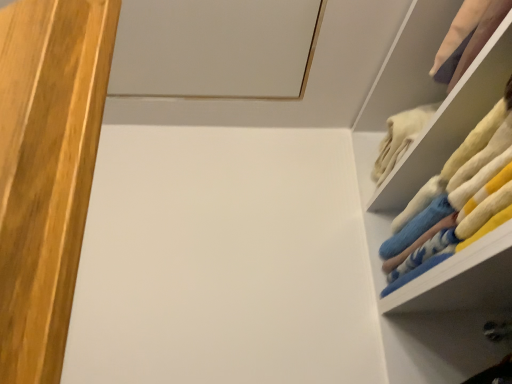
Question: From the image's perspective, is fluffy fabric socks at right located above or below white fluffy towels at upper right?

Choices:
 (A) above
 (B) below

Answer: (B)

Question: Based on their positions, is fluffy fabric socks at right located to the left or right of white fluffy towels at upper right?

Choices:
 (A) right
 (B) left

Answer: (A)

Question: From a real-world perspective, relative to white fluffy towels at upper right, is fluffy fabric socks at right vertically above or below?

Choices:
 (A) above
 (B) below

Answer: (B)

Question: In the image, is white fluffy towels at upper right positioned in front of or behind fluffy fabric socks at right?

Choices:
 (A) behind
 (B) front

Answer: (A)

Question: From a real-world perspective, is white fluffy towels at upper right positioned above or below fluffy fabric socks at right?

Choices:
 (A) below
 (B) above

Answer: (B)

Question: Considering the positions of white fluffy towels at upper right and fluffy fabric socks at right in the image, is white fluffy towels at upper right taller or shorter than fluffy fabric socks at right?

Choices:
 (A) tall
 (B) short

Answer: (B)

Question: Would you say white fluffy towels at upper right is to the left or to the right of fluffy fabric socks at right in the picture?

Choices:
 (A) right
 (B) left

Answer: (B)